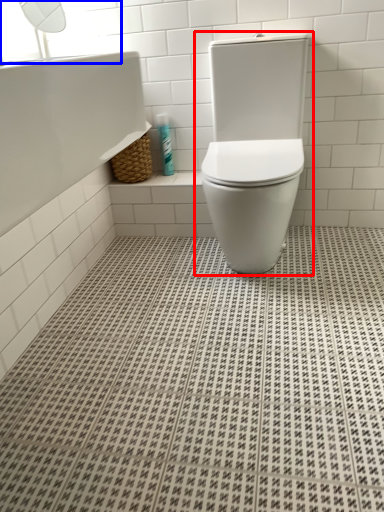
Question: Which object appears farthest to the camera in this image, toilet (highlighted by a red box) or window screen (highlighted by a blue box)?

Choices:
 (A) toilet
 (B) window screen

Answer: (B)